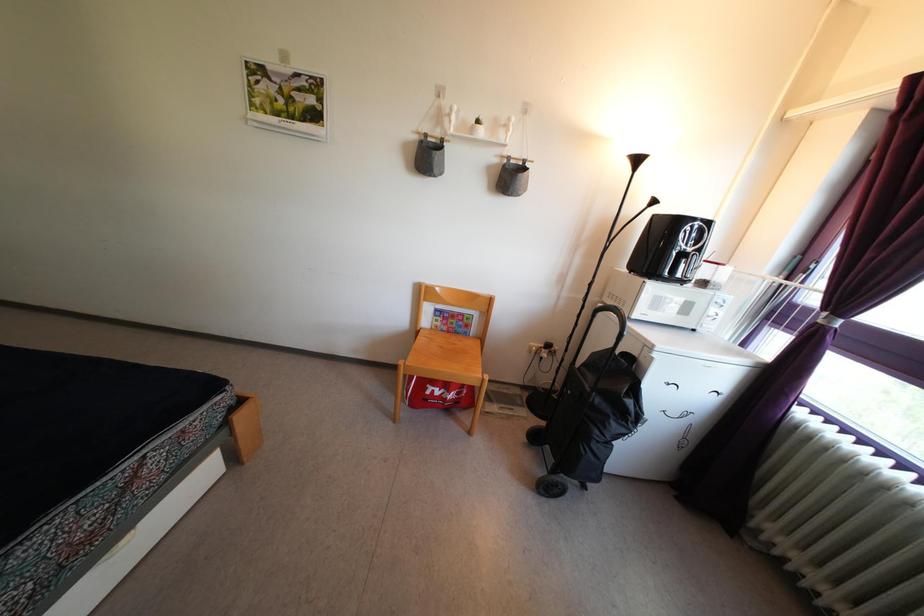
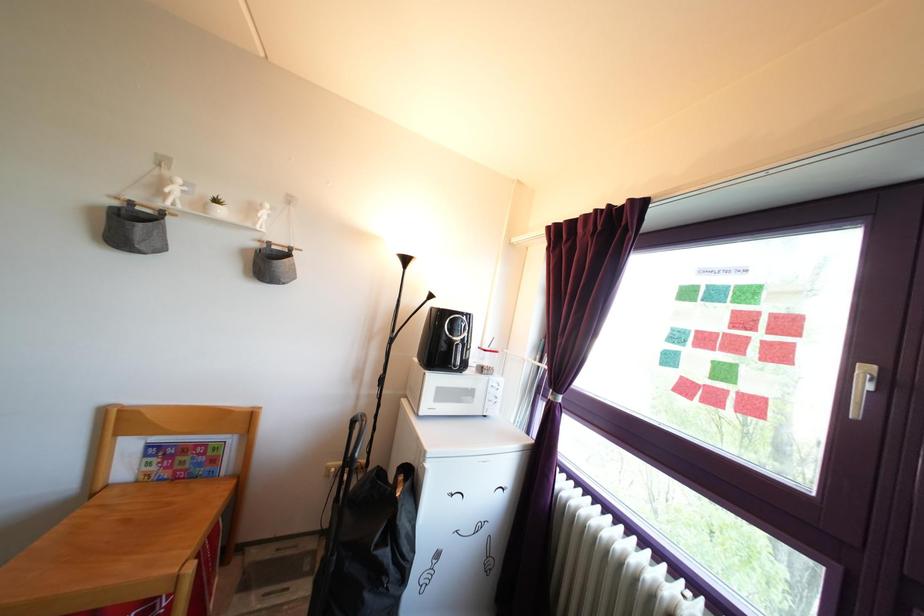
Find the pixel in the second image that matches point 723,310 in the first image.

(499, 394)